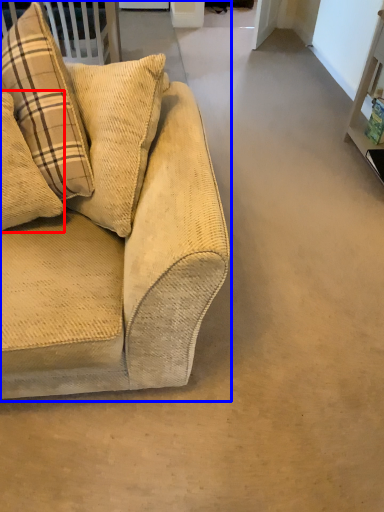
Question: Which object appears closest to the camera in this image, pillow (highlighted by a red box) or studio couch (highlighted by a blue box)?

Choices:
 (A) pillow
 (B) studio couch

Answer: (B)